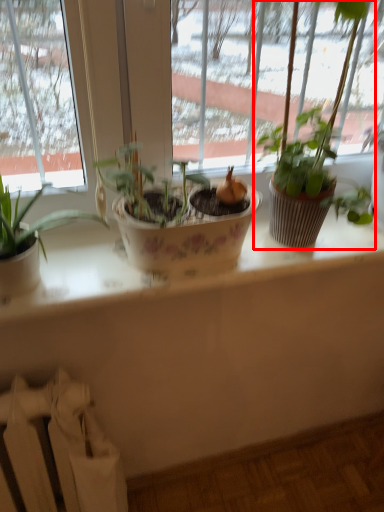
Question: From the image's perspective, considering the relative positions of houseplant (annotated by the red box) and radiator in the image provided, where is houseplant (annotated by the red box) located with respect to the staircase?

Choices:
 (A) above
 (B) below

Answer: (A)